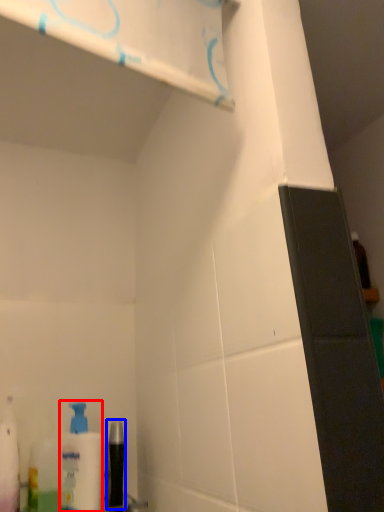
Question: Which object appears closest to the camera in this image, cleaning product (highlighted by a red box) or mouthwash (highlighted by a blue box)?

Choices:
 (A) cleaning product
 (B) mouthwash

Answer: (A)